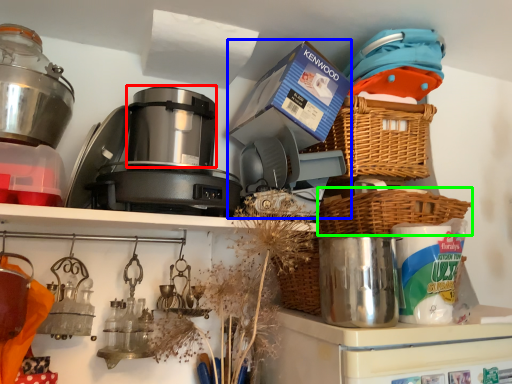
Question: Which object is positioned closest to appliance (highlighted by a red box)? Select from coffee machine (highlighted by a blue box) and basket (highlighted by a green box).

Choices:
 (A) coffee machine
 (B) basket

Answer: (A)